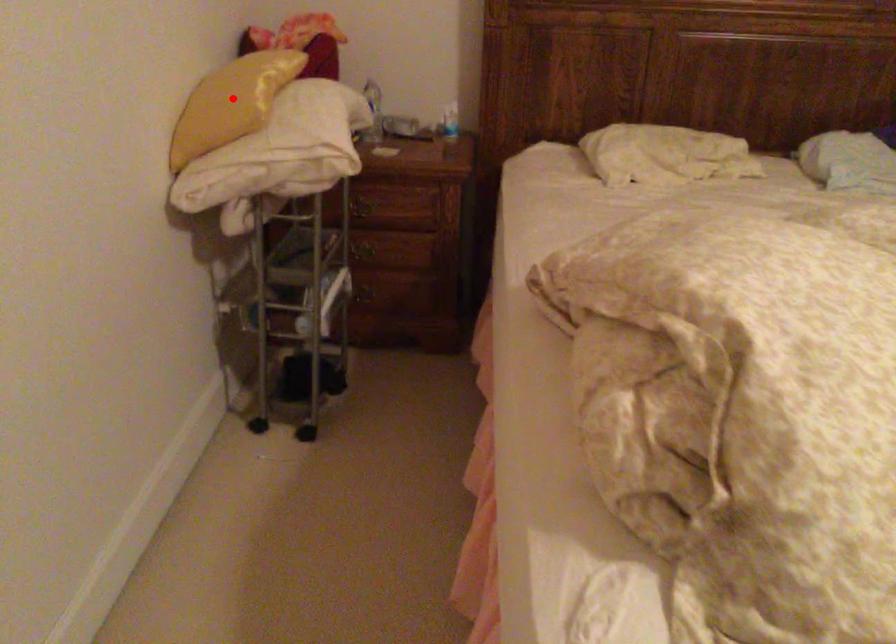
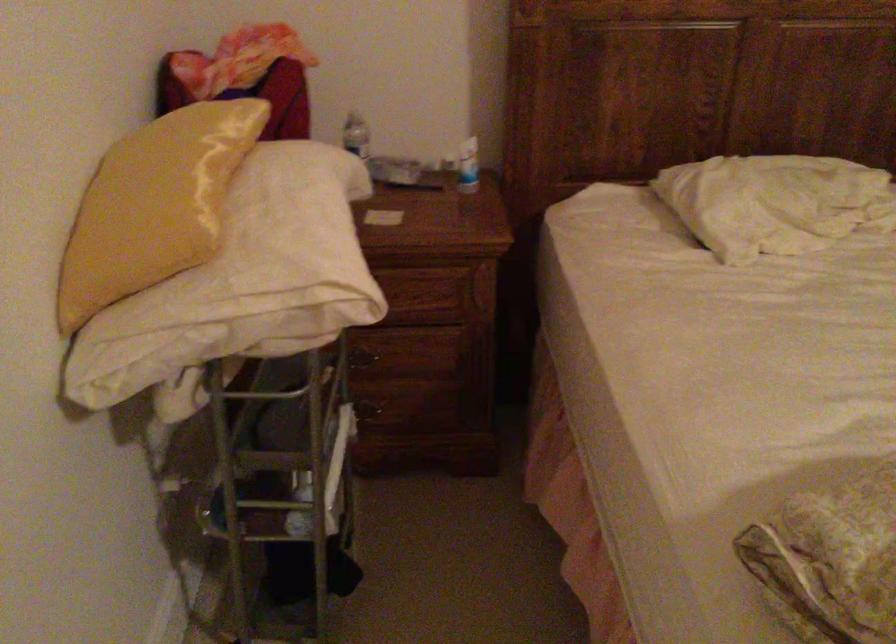
Question: I am providing you with two images of the same scene from different viewpoints. In image1, a red point is highlighted. Considering the same 3D point in image2, which of the following is correct?

Choices:
 (A) It is closer
 (B) It is farther

Answer: (A)